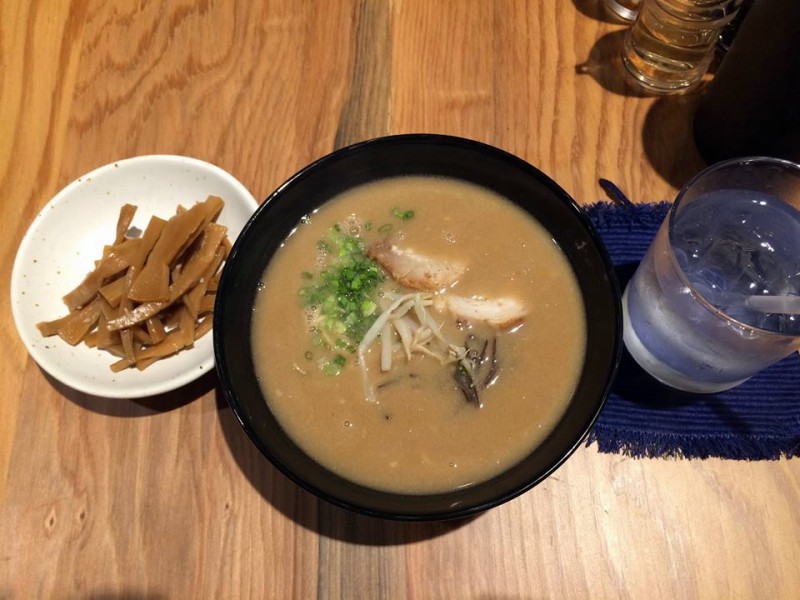
This screenshot has height=600, width=800. In order to click on table in this screenshot , I will do `click(578, 563)`.